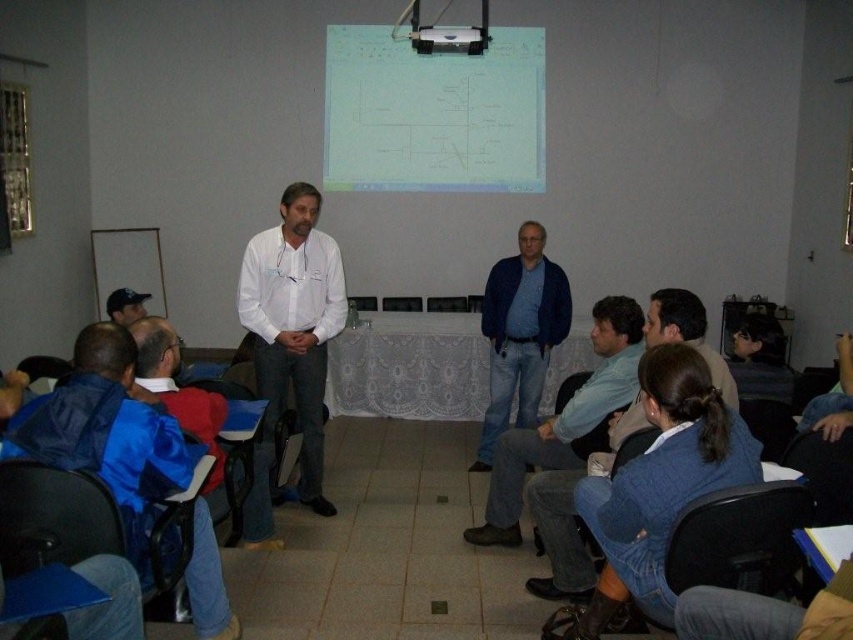
Question: Which point is closer to the camera?

Choices:
 (A) (514, 360)
 (B) (166, 413)

Answer: (B)

Question: Is the position of white shirt at center less distant than that of matte black cap at left?

Choices:
 (A) no
 (B) yes

Answer: (B)

Question: Which is farther from the white lace table at center?

Choices:
 (A) blue denim jeans at center
 (B) black plastic chair at lower right

Answer: (B)

Question: Which point is farther to the camera?

Choices:
 (A) white plastic projector at upper center
 (B) blue jeans at center
 (C) black plastic chair at lower right
 (D) black leather chair at lower right

Answer: (A)

Question: From the image, what is the correct spatial relationship of blue fabric jacket at lower left in relation to black plastic chair at lower right?

Choices:
 (A) left
 (B) right

Answer: (A)

Question: Does blue fabric jacket at lower left have a lesser width compared to black leather chair at lower right?

Choices:
 (A) no
 (B) yes

Answer: (A)